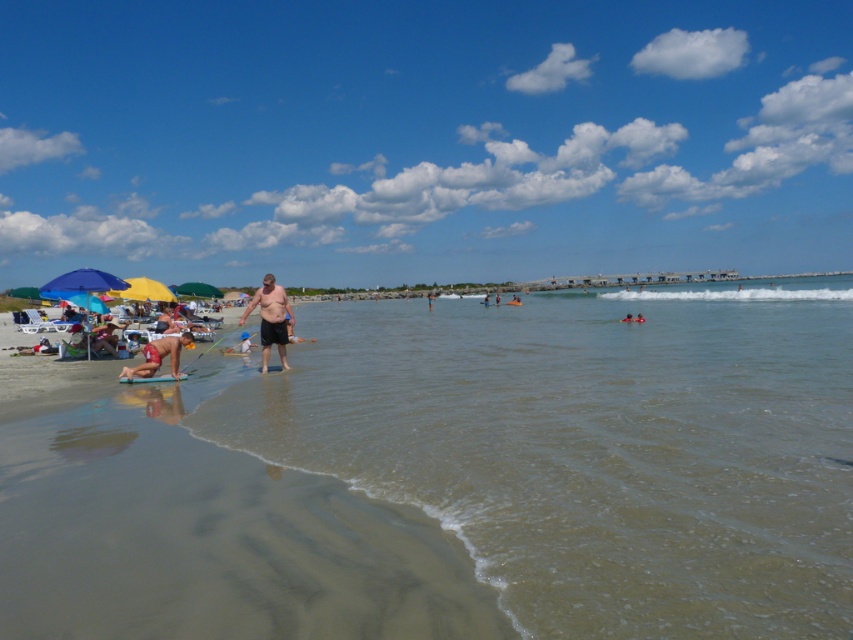
You are a photographer trying to capture the smooth skin person at lower center and the clear water at center in one frame. Based on their sizes, which object should you focus on first to ensure both are in the shot?

The clear water at center is bigger than the smooth skin person at lower center, so you should focus on the clear water at center first to ensure both are in the shot.